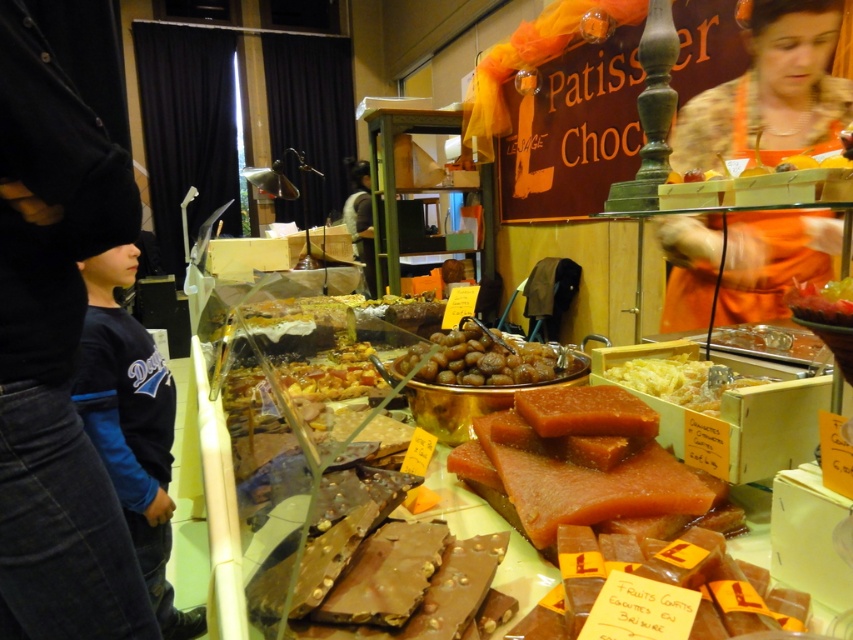
You are a customer at the chocolate shop and want to buy both the blue fleece jacket at left and the black fleece jacket at left. The store has a discount for customers who can reach both items within 20 inches of each other. Are these jackets eligible for the discount?

The blue fleece jacket at left is 18.47 inches from the black fleece jacket at left, which is under the 20 inches requirement, so they are eligible for the discount.

You are a customer trying to take a photo of the display case in the chocolate shop. You are wearing a blue fleece jacket at left. If your camera has a 24mm lens, which has a typical focus range starting at 2 feet, will you be able to focus on the display case while keeping your jacket in the frame?

A: The blue fleece jacket at left is 26.24 inches away from the camera. Since 26.24 inches is approximately 2.19 feet, which is just slightly beyond the 2 feet minimum focus distance of the 24mm lens, you should be able to focus on the display case while keeping the jacket in the frame.